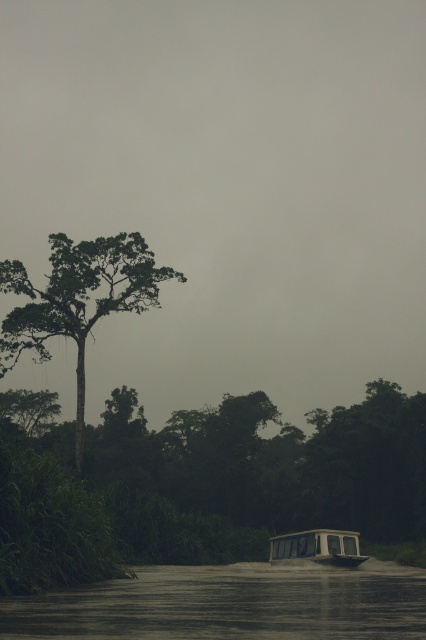
Can you confirm if dark water at lower center is positioned to the left of green matte tree at upper left?

In fact, dark water at lower center is to the right of green matte tree at upper left.

Is dark water at lower center below green matte tree at upper left?

Yes, dark water at lower center is below green matte tree at upper left.

Is point (299, 593) less distant than point (77, 387)?

Yes, it is.

I want to click on dark water at lower center, so click(x=230, y=604).

Can you confirm if green matte tree at upper left is shorter than white plastic boat at lower center?

No, green matte tree at upper left is not shorter than white plastic boat at lower center.

Between green matte tree at upper left and white plastic boat at lower center, which one has more height?

With more height is green matte tree at upper left.

The width and height of the screenshot is (426, 640). I want to click on green matte tree at upper left, so click(77, 300).

Where is `green matte tree at upper left`? green matte tree at upper left is located at coordinates (77, 300).

Is point (414, 609) closer to viewer compared to point (276, 550)?

Yes.

Which of these two, dark water at lower center or white plastic boat at lower center, stands taller?

dark water at lower center is taller.

Which is in front, point (259, 612) or point (357, 532)?

Point (259, 612) is in front.

Find the location of a particular element. The width and height of the screenshot is (426, 640). dark water at lower center is located at coordinates (230, 604).